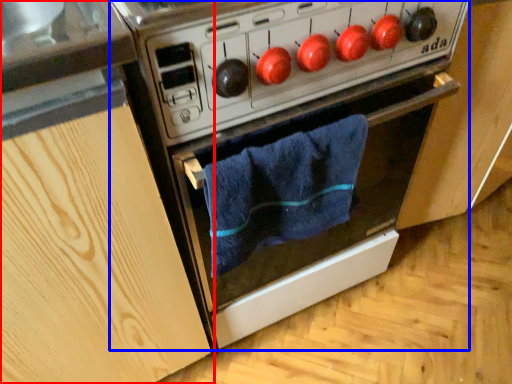
Question: Which object appears closest to the camera in this image, cabinetry (highlighted by a red box) or oven (highlighted by a blue box)?

Choices:
 (A) cabinetry
 (B) oven

Answer: (A)